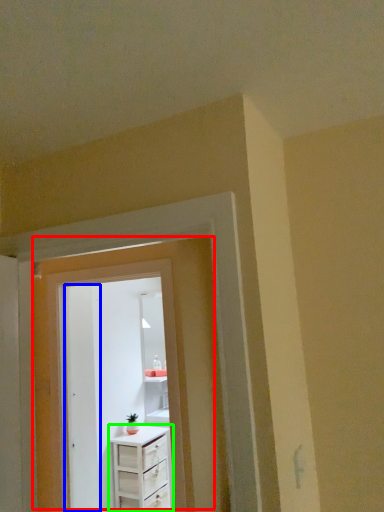
Question: Based on their relative distances, which object is farther from door (highlighted by a red box)? Choose from door (highlighted by a blue box) and chest of drawers (highlighted by a green box).

Choices:
 (A) door
 (B) chest of drawers

Answer: (B)